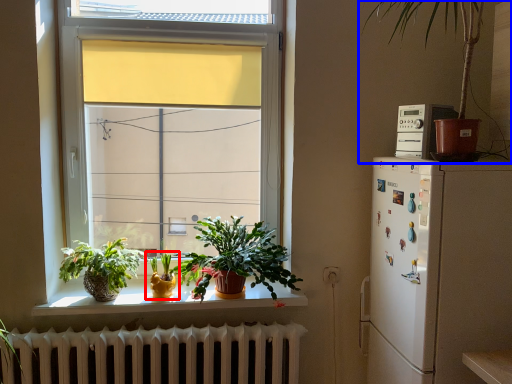
Question: Which of the following is the closest to the observer, houseplant (highlighted by a red box) or houseplant (highlighted by a blue box)?

Choices:
 (A) houseplant
 (B) houseplant

Answer: (B)